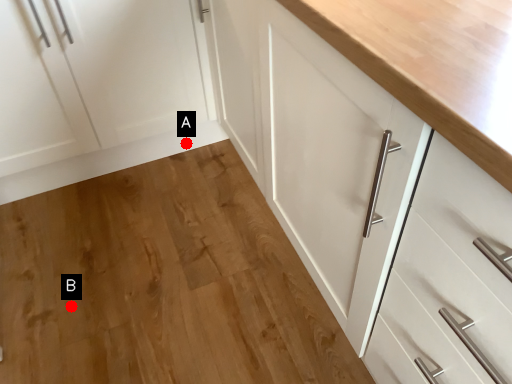
Question: Two points are circled on the image, labeled by A and B beside each circle. Which point is farther from the camera taking this photo?

Choices:
 (A) A is further
 (B) B is further

Answer: (A)